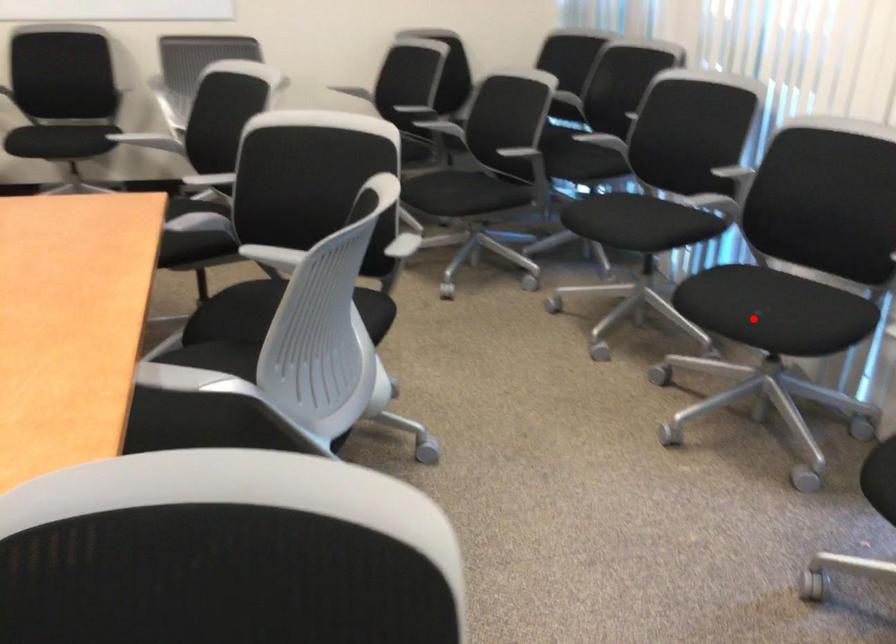
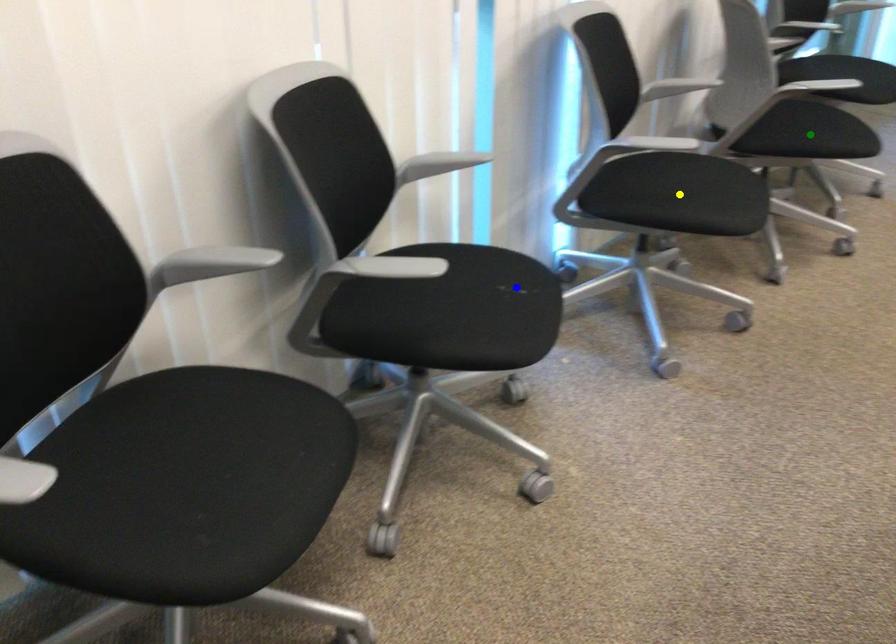
Question: I am providing you with two images of the same scene from different viewpoints. A red point is marked on the first image. You are given multiple points on the second image. Can you choose the point in image 2 that corresponds to the point in image 1?

Choices:
 (A) blue point
 (B) green point
 (C) yellow point

Answer: (A)